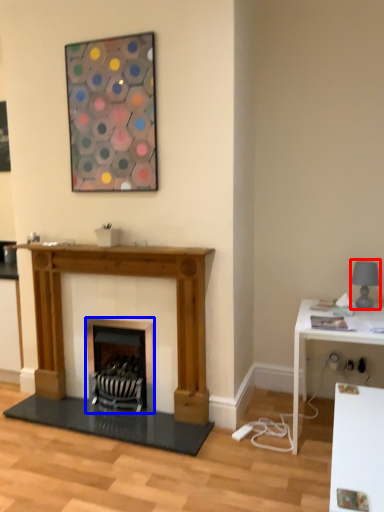
Question: Which point is further to the camera, lamp (highlighted by a red box) or wood burning stove (highlighted by a blue box)?

Choices:
 (A) lamp
 (B) wood burning stove

Answer: (B)